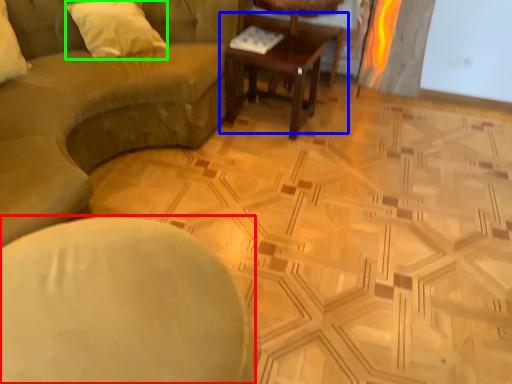
Question: Which object is the farthest from chair (highlighted by a red box)? Choose among these: coffee table (highlighted by a blue box) or pillow (highlighted by a green box).

Choices:
 (A) coffee table
 (B) pillow

Answer: (A)